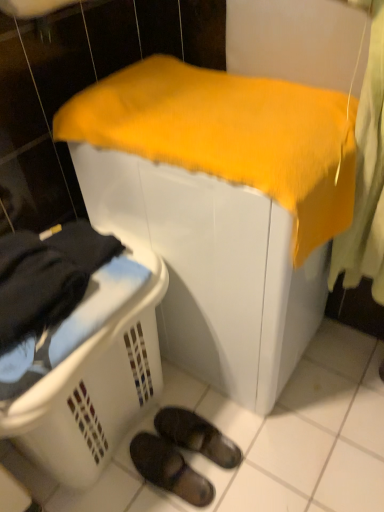
At what (x,y) coordinates should I click in order to perform the action: click on vacant space behind black rubber slippers at lower center, the first footwear when ordered from bottom to top. Please return your answer as a coordinate pair (x, y). The image size is (384, 512). Looking at the image, I should click on (183, 407).